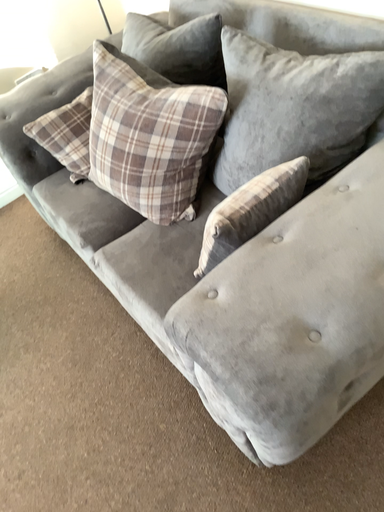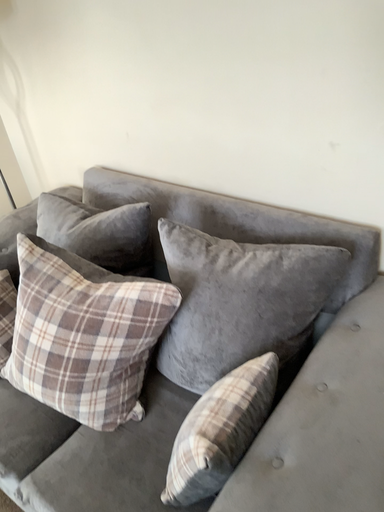
Question: How did the camera likely rotate when shooting the video?

Choices:
 (A) rotated downward
 (B) rotated upward

Answer: (B)